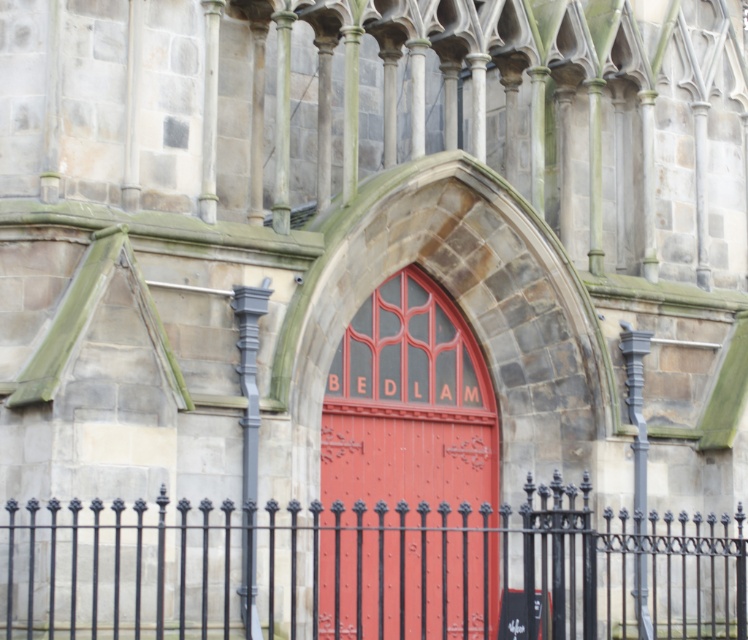
Who is lower down, black wrought iron fence at lower center or smooth red door at center?

black wrought iron fence at lower center is lower down.

Which is behind, point (677, 563) or point (470, 333)?

The point (677, 563) is behind.

Who is more distant from viewer, (286, 556) or (367, 611)?

The point (367, 611) is more distant.

Locate an element on the screen. The width and height of the screenshot is (748, 640). black wrought iron fence at lower center is located at coordinates (374, 570).